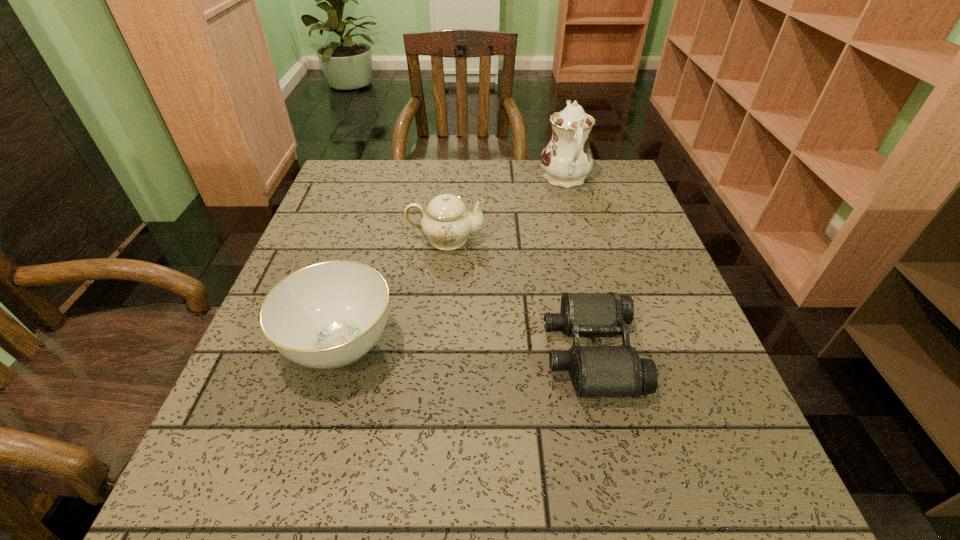
In order to click on the rightmost chinaware in this screenshot , I will do [567, 159].

The image size is (960, 540). What are the coordinates of `the tallest chinaware` in the screenshot? It's located at (567, 159).

The height and width of the screenshot is (540, 960). What are the coordinates of `the second farthest object` in the screenshot? It's located at (447, 222).

At what (x,y) coordinates should I click in order to perform the action: click on the nearest chinaware. Please return your answer as a coordinate pair (x, y). The height and width of the screenshot is (540, 960). Looking at the image, I should click on (328, 315).

Locate an element on the screen. The width and height of the screenshot is (960, 540). the shortest object is located at coordinates (596, 371).

Find the location of `vacant position located 0.130m on the left of the tallest object`. vacant position located 0.130m on the left of the tallest object is located at coordinates (493, 179).

In order to click on vacant position located at the spout of the second nearest chinaware in this screenshot , I will do `click(536, 239)`.

Locate an element on the screen. The height and width of the screenshot is (540, 960). free location located on the back of the nearest chinaware is located at coordinates (363, 268).

I want to click on vacant area situated 0.110m through the eyepieces of the shortest object, so click(x=486, y=352).

The image size is (960, 540). In order to click on vacant area situated through the eyepieces of the shortest object in this screenshot , I will do click(x=425, y=352).